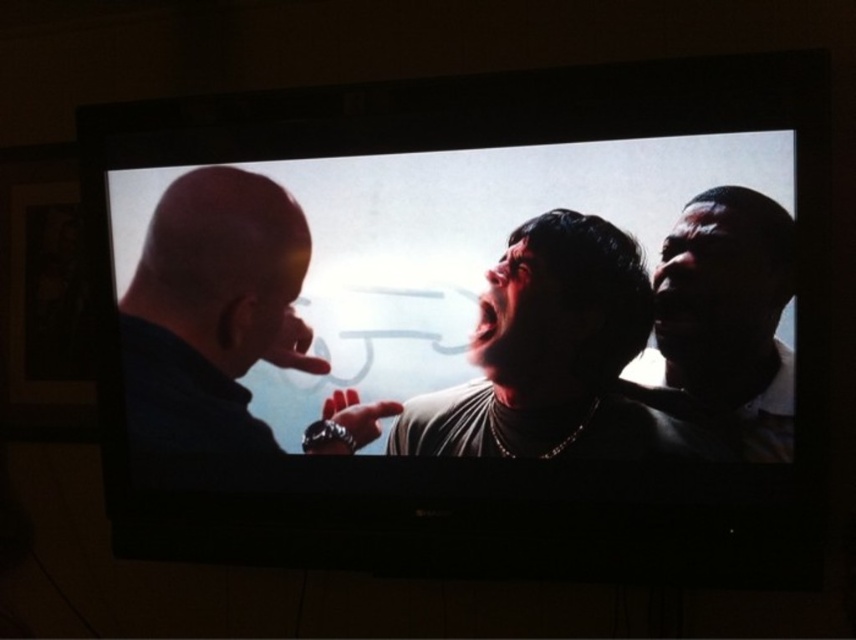
You are a movie director analyzing the scene on the TV screen. You notice the bald head at left and the dark skin textured face at right. Which character is positioned higher in the frame?

The bald head at left is positioned higher in the frame than the dark skin textured face at right.

You are a movie director observing the scene on the TV screen. You want to adjust the camera angle so that the dark gray shirt at center is now in front of the bald head at left. Is this possible given their current positions?

The dark gray shirt at center is currently behind the bald head at left. To place it in front, you would need to reposition the camera angle so that the dark gray shirt at center moves forward relative to the bald head at left.

You are a movie director analyzing the scene on the TV screen. You need to determine the spatial relationship between the dark gray shirt at center and the dark skin textured face at right. Which object is closer to the camera based on their positions?

The dark gray shirt at center is closer to the camera than the dark skin textured face at right because it is positioned further to the viewer.